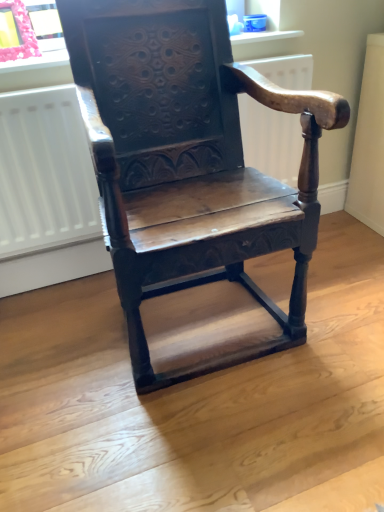
Locate an element on the screen. vacant area that lies to the right of wooden carved chair at center is located at coordinates (338, 293).